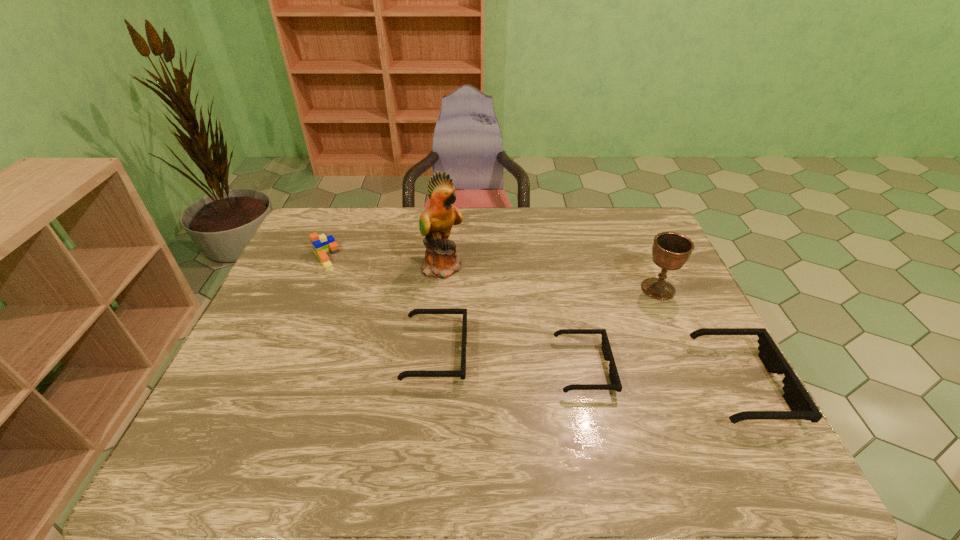
The width and height of the screenshot is (960, 540). I want to click on the second shortest object, so click(x=462, y=374).

Identify the location of the second shortest sunglasses. The height and width of the screenshot is (540, 960). (462, 374).

What are the coordinates of `the fourth object from left to right` in the screenshot? It's located at (616, 385).

Where is `the shortest sunglasses`? Image resolution: width=960 pixels, height=540 pixels. the shortest sunglasses is located at coordinates (616, 385).

Locate an element on the screen. Image resolution: width=960 pixels, height=540 pixels. the rightmost sunglasses is located at coordinates (802, 407).

This screenshot has width=960, height=540. Identify the location of parrot. (436, 221).

Identify the location of Lego. Image resolution: width=960 pixels, height=540 pixels. (321, 244).

What are the coordinates of `the fourth shortest object` in the screenshot? It's located at (321, 244).

Locate an element on the screen. This screenshot has height=540, width=960. the fifth shortest object is located at coordinates (670, 250).

Locate an element on the screen. This screenshot has width=960, height=540. vacant space positioned 0.170m on the front-facing side of the leftmost sunglasses is located at coordinates (534, 353).